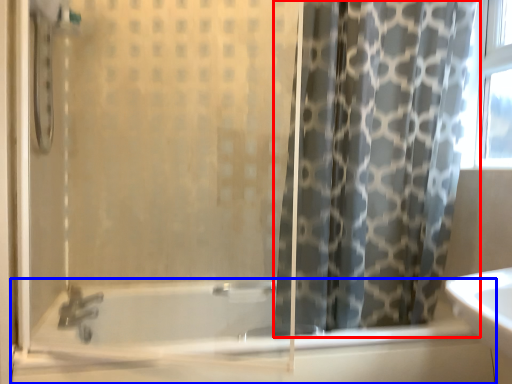
Question: Among these objects, which one is nearest to the camera, curtain (highlighted by a red box) or bathtub (highlighted by a blue box)?

Choices:
 (A) curtain
 (B) bathtub

Answer: (B)